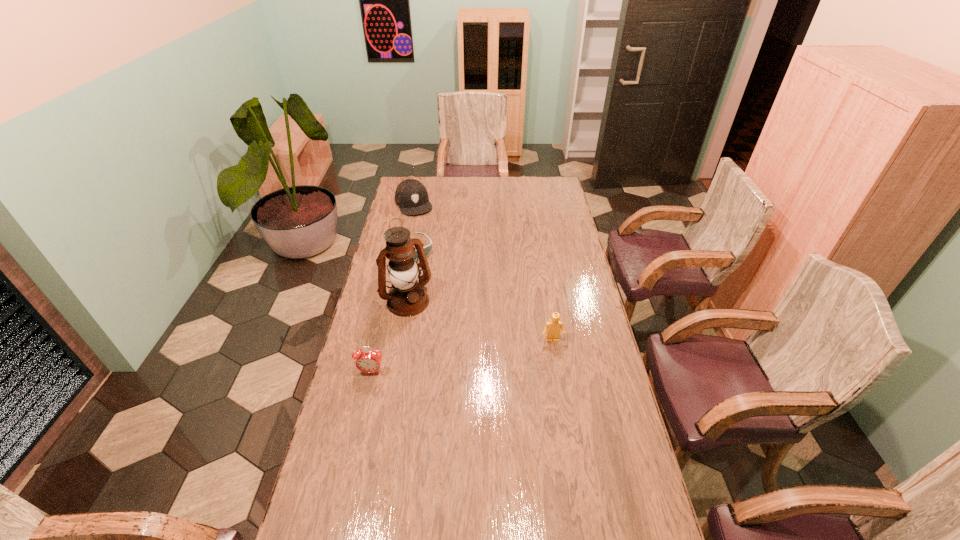
Locate an element on the screen. the nearest object is located at coordinates (366, 361).

Identify the location of the fourth farthest object. (554, 326).

Identify the location of the rightmost object. Image resolution: width=960 pixels, height=540 pixels. (554, 326).

Where is `lantern`? The width and height of the screenshot is (960, 540). lantern is located at coordinates (407, 297).

Locate an element on the screen. The height and width of the screenshot is (540, 960). the third nearest object is located at coordinates (407, 297).

This screenshot has height=540, width=960. Find the location of `goggles`. goggles is located at coordinates (427, 249).

At what (x,y) coordinates should I click in order to perform the action: click on the shortest object. Please return your answer as a coordinate pair (x, y). Looking at the image, I should click on (427, 249).

I want to click on cap, so 411,196.

Where is `free location located 0.240m on the face of the nearest object`? The image size is (960, 540). free location located 0.240m on the face of the nearest object is located at coordinates (355, 442).

What are the coordinates of `vacant region located 0.190m on the face of the Lego` in the screenshot? It's located at (561, 389).